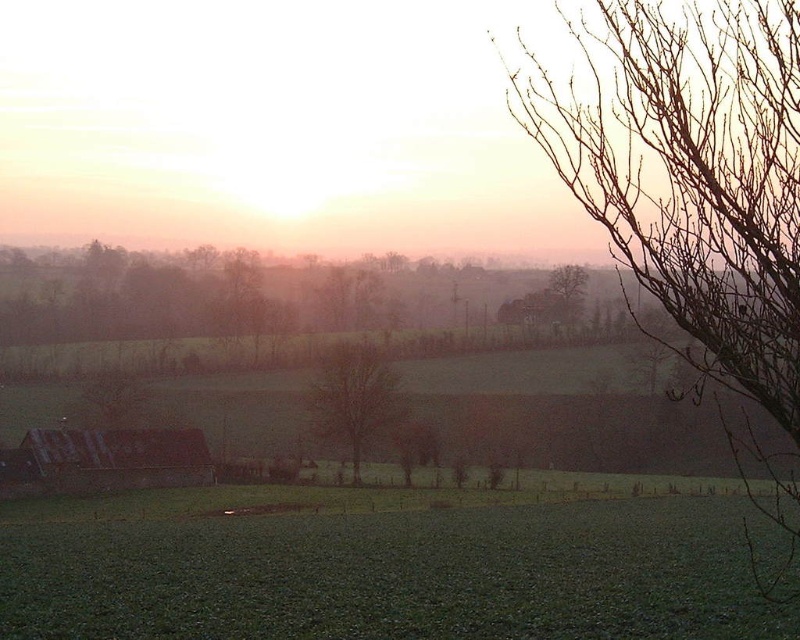
Question: Is the position of green grassy field at lower center less distant than that of bare branches at upper center?

Choices:
 (A) yes
 (B) no

Answer: (A)

Question: Which point is closer to the camera?

Choices:
 (A) (594, 516)
 (B) (576, 278)
 (C) (360, 397)
 (D) (694, 64)

Answer: (D)

Question: Estimate the real-world distances between objects in this image. Which object is farther from the bare tree at center?

Choices:
 (A) bare branches at upper center
 (B) rustic wooden hut at lower left
 (C) bare branches at upper right
 (D) green grassy field at lower center

Answer: (C)

Question: Which point appears closest to the camera in this image?

Choices:
 (A) (768, 204)
 (B) (524, 602)

Answer: (A)

Question: Does green grassy field at lower center have a lesser width compared to bare tree at center?

Choices:
 (A) no
 (B) yes

Answer: (A)

Question: Can you confirm if green grassy field at lower center is thinner than bare branches at upper center?

Choices:
 (A) yes
 (B) no

Answer: (B)